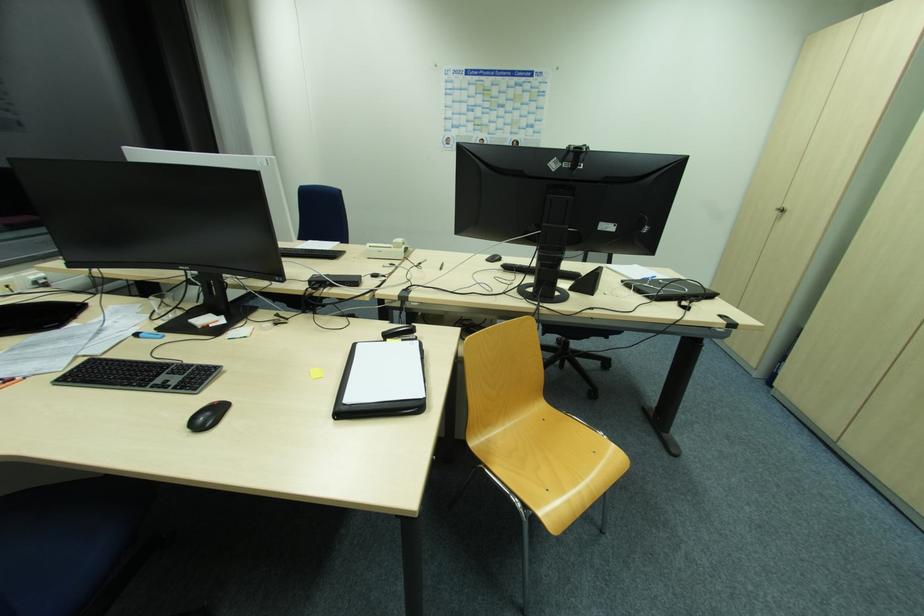
Locate an element on the screen. silver cabinet lock is located at coordinates (781, 209).